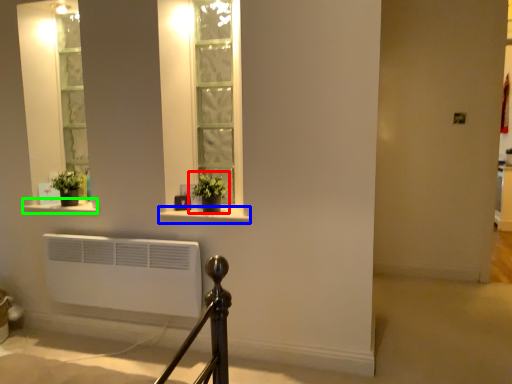
Question: Which is nearer to the houseplant (highlighted by a red box)? window sill (highlighted by a blue box) or window sill (highlighted by a green box).

Choices:
 (A) window sill
 (B) window sill

Answer: (A)